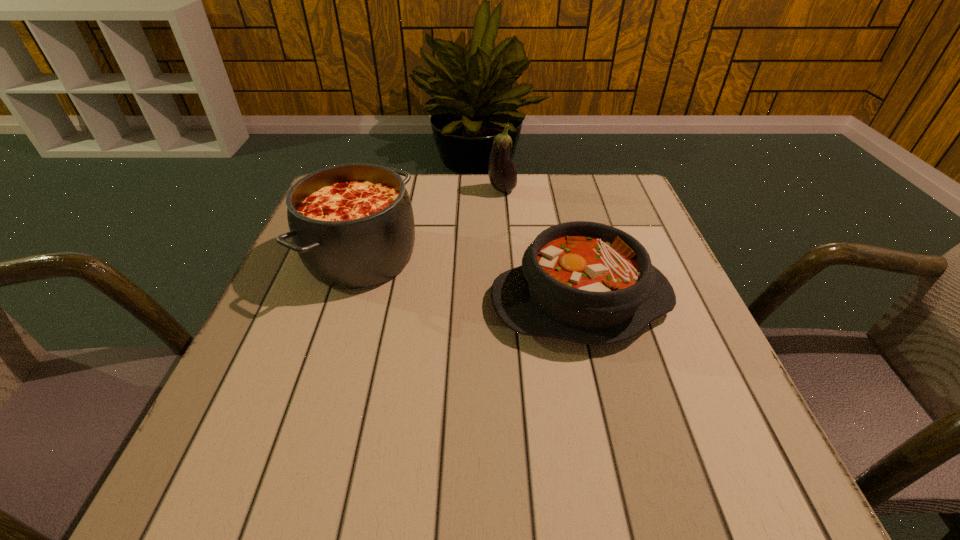
Where is `object positioned at the left edge`? object positioned at the left edge is located at coordinates (352, 225).

The width and height of the screenshot is (960, 540). Find the location of `object present at the right edge`. object present at the right edge is located at coordinates (590, 283).

Find the location of a particular element. object that is at the far left corner is located at coordinates (352, 225).

You are a GUI agent. You are given a task and a screenshot of the screen. Output one action in this format:
    pyautogui.click(x=<x>, y=<y>)
    Task: Click on the vacant space at the far edge of the desktop
    The height and width of the screenshot is (540, 960).
    Given the screenshot: What is the action you would take?
    pyautogui.click(x=517, y=217)

In the image, there is a desktop. Identify the location of vacant space at the near edge. (509, 449).

This screenshot has width=960, height=540. In order to click on vacant space at the left edge in this screenshot , I will do `click(325, 327)`.

You are a GUI agent. You are given a task and a screenshot of the screen. Output one action in this format:
    pyautogui.click(x=<x>, y=<y>)
    Task: Click on the vacant position at the right edge of the desktop
    
    Given the screenshot: What is the action you would take?
    (684, 368)

This screenshot has height=540, width=960. I want to click on vacant point at the far right corner, so (x=610, y=184).

Locate an element on the screen. free space between the taller casserole and the shorter casserole is located at coordinates (471, 279).

The image size is (960, 540). I want to click on vacant area that lies between the shorter casserole and the leftmost object, so click(x=471, y=279).